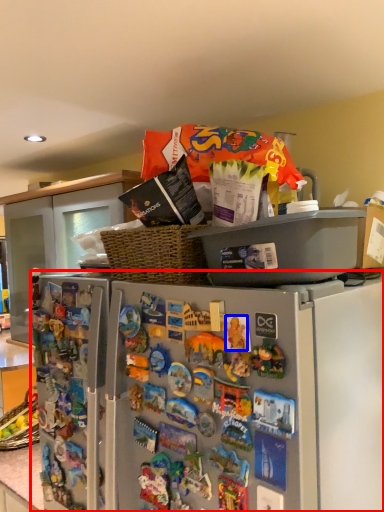
Question: Which point is closer to the camera, refrigerator (highlighted by a red box) or toy (highlighted by a blue box)?

Choices:
 (A) refrigerator
 (B) toy

Answer: (B)